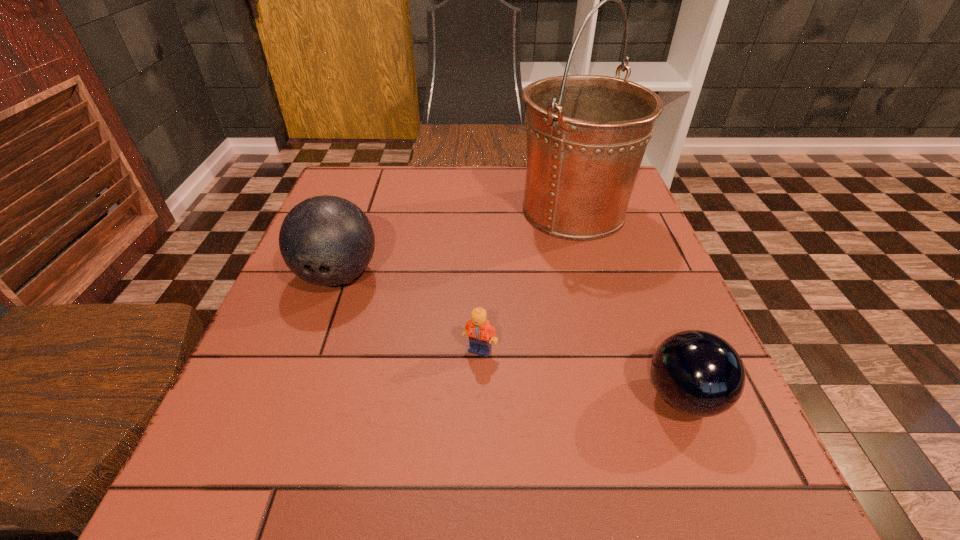
The height and width of the screenshot is (540, 960). In order to click on free space located 0.290m on the side of the nearest object with the finger holes in this screenshot , I will do `click(462, 397)`.

At what (x,y) coordinates should I click in order to perform the action: click on vacant space located 0.210m on the side of the nearest object with the finger holes. Please return your answer as a coordinate pair (x, y). The width and height of the screenshot is (960, 540). Looking at the image, I should click on (512, 397).

The width and height of the screenshot is (960, 540). Find the location of `vacant space located on the side of the nearest object with the finger holes`. vacant space located on the side of the nearest object with the finger holes is located at coordinates [x=574, y=397].

I want to click on vacant space situated 0.210m on the front-facing side of the second object from left to right, so click(480, 481).

Locate an element on the screen. Image resolution: width=960 pixels, height=540 pixels. object located in the far edge section of the desktop is located at coordinates (586, 134).

Find the location of a particular element. object at the left edge is located at coordinates [325, 240].

The image size is (960, 540). Identify the location of bucket that is at the right edge. (586, 134).

Locate an element on the screen. Image resolution: width=960 pixels, height=540 pixels. bowling ball that is at the right edge is located at coordinates (697, 373).

What are the coordinates of `object located in the far right corner section of the desktop` in the screenshot? It's located at (586, 134).

The width and height of the screenshot is (960, 540). I want to click on free space at the far edge, so click(x=492, y=177).